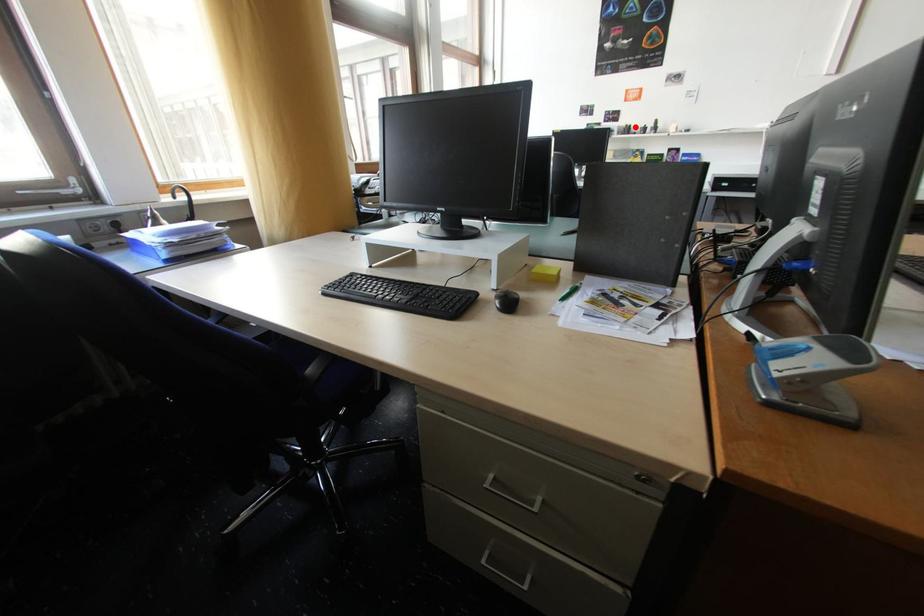
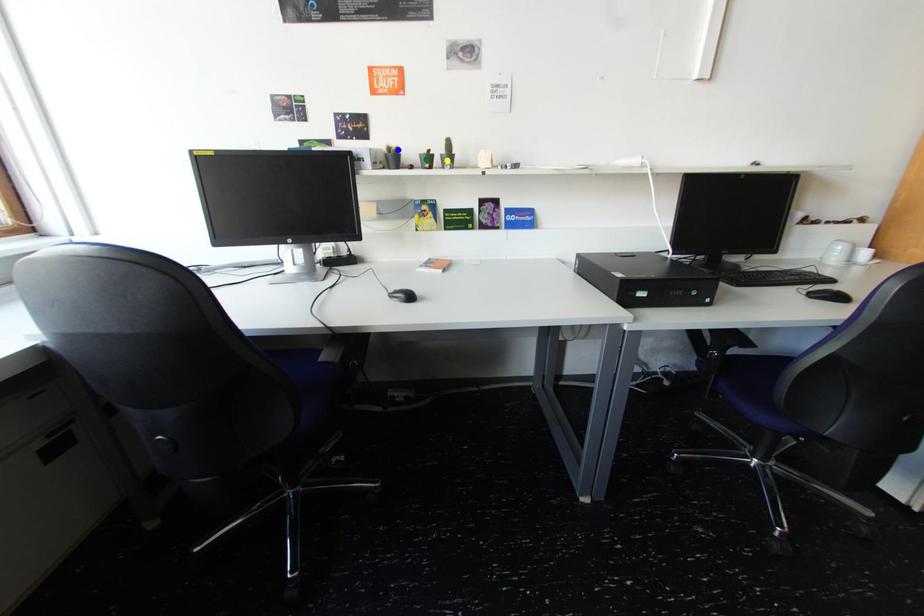
Question: I am providing you with two images of the same scene from different viewpoints. A red point is marked on the first image. You are given multiple points on the second image. Can you choose the point in image 2 that corresponds to the point in image 1?

Choices:
 (A) yellow point
 (B) blue point
 (C) green point

Answer: (B)